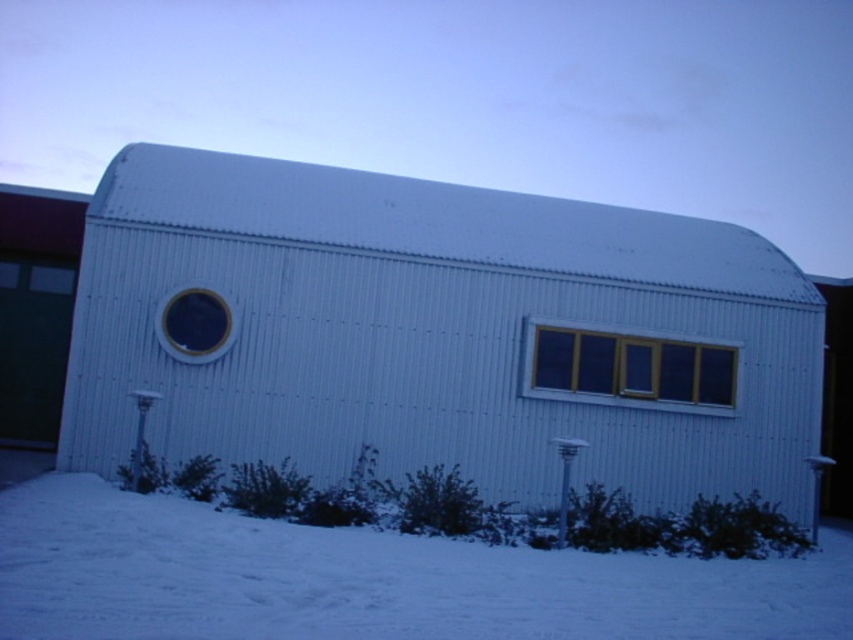
Question: Which point is closer to the camera taking this photo?

Choices:
 (A) (346, 636)
 (B) (399, 257)
 (C) (722, 396)

Answer: (A)

Question: Which is nearer to the white powdery snow at lower center?

Choices:
 (A) yellow matte window at center
 (B) white corrugated metal shed at center

Answer: (A)

Question: Which object appears closest to the camera in this image?

Choices:
 (A) white corrugated metal shed at center
 (B) matte black circular window at center-left
 (C) white powdery snow at lower center
 (D) yellow matte window at center

Answer: (C)

Question: Can you confirm if white corrugated metal shed at center is smaller than matte black circular window at center-left?

Choices:
 (A) no
 (B) yes

Answer: (A)

Question: Is yellow matte window at center thinner than matte black circular window at center-left?

Choices:
 (A) no
 (B) yes

Answer: (A)

Question: Can you confirm if white powdery snow at lower center is smaller than matte black circular window at center-left?

Choices:
 (A) yes
 (B) no

Answer: (A)